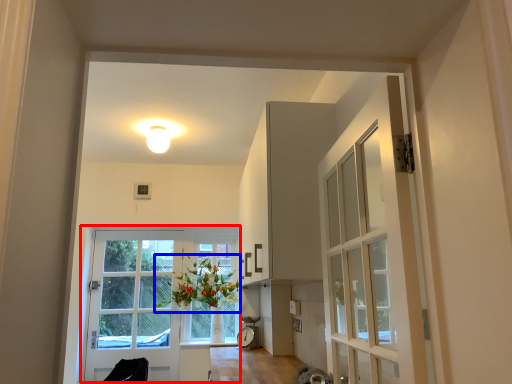
Question: Which object appears farthest to the camera in this image, door (highlighted by a red box) or floral arrangement (highlighted by a blue box)?

Choices:
 (A) door
 (B) floral arrangement

Answer: (A)